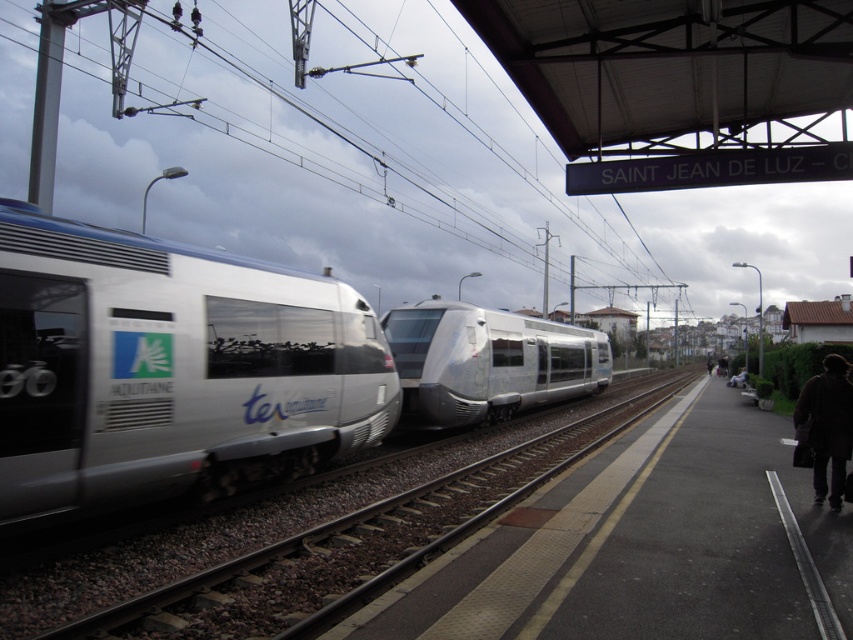
Question: Can you confirm if silver metallic train track at center is bigger than silver metallic bullet train at center?

Choices:
 (A) no
 (B) yes

Answer: (A)

Question: Is silver metallic train track at center further to camera compared to silver metallic bullet train at center?

Choices:
 (A) yes
 (B) no

Answer: (B)

Question: Based on their relative distances, which object is farther from the silver metallic bullet train at center?

Choices:
 (A) silver metallic train track at center
 (B) silver metallic train at left

Answer: (B)

Question: Does silver metallic train track at center lie in front of silver metallic bullet train at center?

Choices:
 (A) yes
 (B) no

Answer: (A)

Question: Which of these objects is positioned farthest from the silver metallic train at left?

Choices:
 (A) silver metallic bullet train at center
 (B) silver metallic train track at center

Answer: (A)

Question: Which object appears closest to the camera in this image?

Choices:
 (A) silver metallic train track at center
 (B) silver metallic bullet train at center
 (C) silver metallic train at left

Answer: (A)